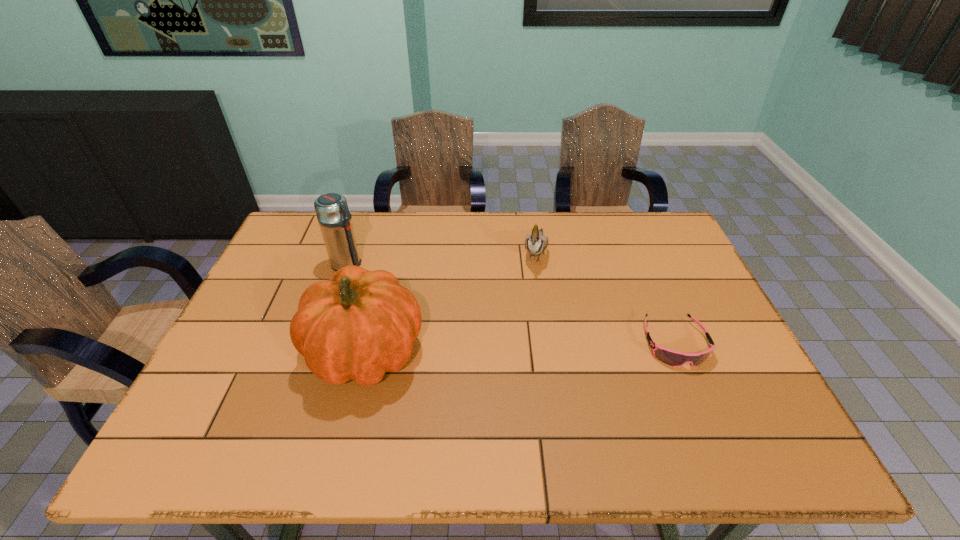
The height and width of the screenshot is (540, 960). Find the location of `vacant spot on the desktop that is between the pumpkin and the shortest object and is positioned with a handle on the side of the thermos bottle`. vacant spot on the desktop that is between the pumpkin and the shortest object and is positioned with a handle on the side of the thermos bottle is located at coordinates (525, 347).

Find the location of a particular element. The height and width of the screenshot is (540, 960). vacant space on the desktop that is between the pumpkin and the rightmost object and is positioned at the face of the third object from left to right is located at coordinates (509, 348).